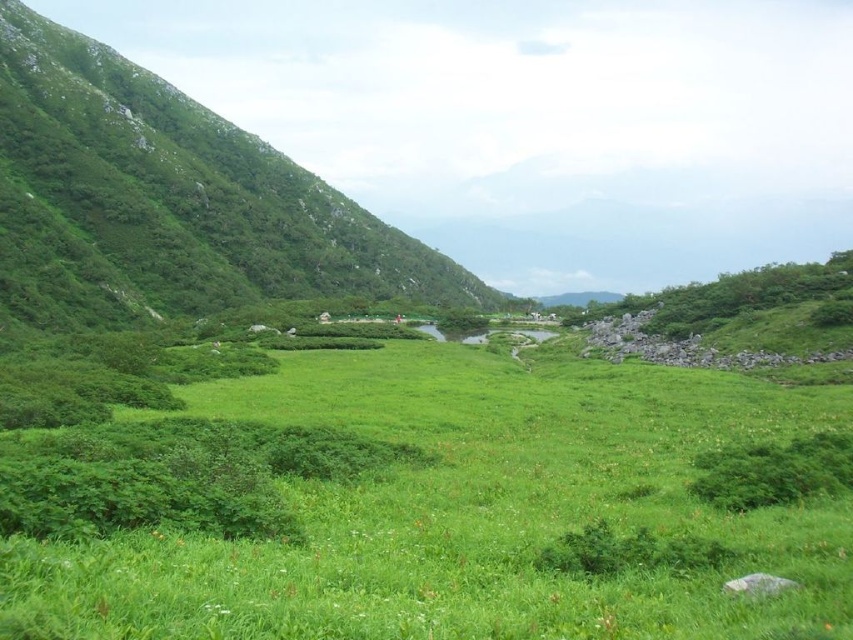
Question: Can you confirm if green grassy field at center is positioned to the right of green grassy hillside at left?

Choices:
 (A) no
 (B) yes

Answer: (B)

Question: Which of the following is the farthest from the observer?

Choices:
 (A) green grassy hillside at left
 (B) green grassy field at center

Answer: (A)

Question: Which point is closer to the camera?

Choices:
 (A) (103, 67)
 (B) (238, 538)

Answer: (B)

Question: Among these points, which one is farthest from the camera?

Choices:
 (A) (550, 630)
 (B) (73, 54)

Answer: (B)

Question: Is green grassy field at center further to the viewer compared to green grassy hillside at left?

Choices:
 (A) yes
 (B) no

Answer: (B)

Question: Where is green grassy field at center located in relation to green grassy hillside at left in the image?

Choices:
 (A) right
 (B) left

Answer: (A)